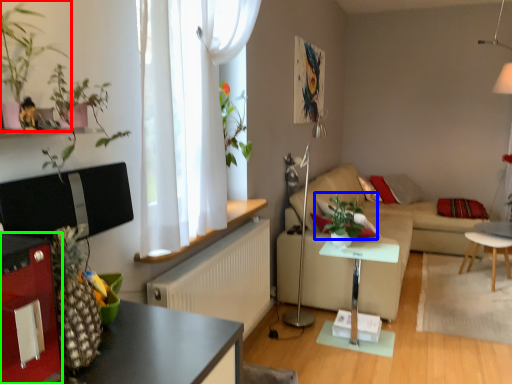
Question: Which is nearer to the houseplant (highlighted by a red box)? plant (highlighted by a blue box) or cabinetry (highlighted by a green box).

Choices:
 (A) plant
 (B) cabinetry

Answer: (B)